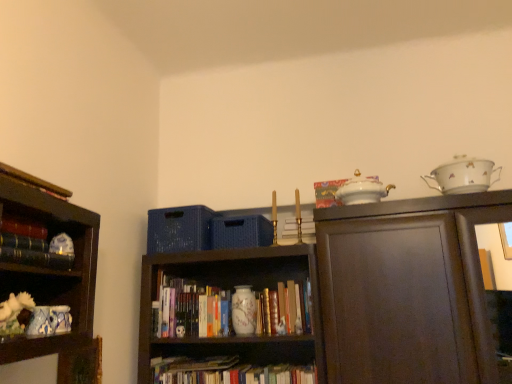
Question: Is hardcover book at center, placed as the 2th book when sorted from front to back, bigger than hardcover books at center, the 1th book ordered from the bottom?

Choices:
 (A) no
 (B) yes

Answer: (A)

Question: Can you confirm if hardcover book at center, which appears as the second book when viewed from the back, is thinner than hardcover books at center, the second book in the left-to-right sequence?

Choices:
 (A) yes
 (B) no

Answer: (A)

Question: Can you confirm if hardcover book at center, placed as the 2th book when sorted from front to back, is wider than hardcover books at center, which appears as the third book when viewed from the top?

Choices:
 (A) no
 (B) yes

Answer: (A)

Question: Does hardcover book at center, the first book from the right, have a smaller size compared to hardcover books at center, arranged as the 2th book when viewed from the right?

Choices:
 (A) yes
 (B) no

Answer: (A)

Question: From a real-world perspective, is hardcover book at center, the 2th book viewed from the top, positioned under hardcover books at center, the second book in the left-to-right sequence, based on gravity?

Choices:
 (A) yes
 (B) no

Answer: (A)

Question: Does point (289, 279) appear closer or farther from the camera than point (192, 322)?

Choices:
 (A) farther
 (B) closer

Answer: (A)

Question: In terms of height, does hardcover book at center, which ranks as the 3th book in left-to-right order, look taller or shorter compared to hardcover books at center, the second book in the left-to-right sequence?

Choices:
 (A) tall
 (B) short

Answer: (B)

Question: Considering the positions of hardcover book at center, placed as the 2th book when sorted from front to back, and hardcover books at center, the second book in the left-to-right sequence, in the image, is hardcover book at center, placed as the 2th book when sorted from front to back, bigger or smaller than hardcover books at center, the second book in the left-to-right sequence,?

Choices:
 (A) small
 (B) big

Answer: (A)

Question: In terms of width, does hardcover book at center, which is the 2th book in bottom-to-top order, look wider or thinner when compared to hardcover books at center, the second book in the left-to-right sequence?

Choices:
 (A) wide
 (B) thin

Answer: (B)

Question: From a real-world perspective, is hardcover books at center, which is the 1th book in back-to-front order, above or below white porcelain teapot at upper center?

Choices:
 (A) above
 (B) below

Answer: (B)

Question: From the image's perspective, is hardcover books at center, which appears as the third book when viewed from the top, above or below white porcelain teapot at upper center?

Choices:
 (A) below
 (B) above

Answer: (A)

Question: Is hardcover books at center, the 1th book ordered from the bottom, spatially inside white porcelain teapot at upper center, or outside of it?

Choices:
 (A) outside
 (B) inside

Answer: (A)

Question: Considering their positions, is hardcover books at center, arranged as the 2th book when viewed from the right, located in front of or behind white porcelain teapot at upper center?

Choices:
 (A) front
 (B) behind

Answer: (B)

Question: Considering the positions of white porcelain teapot at upper center and hardcover book at center, the first book from the right, in the image, is white porcelain teapot at upper center wider or thinner than hardcover book at center, the first book from the right,?

Choices:
 (A) wide
 (B) thin

Answer: (A)

Question: From the image's perspective, is white porcelain teapot at upper center positioned above or below hardcover book at center, which is the 2th book in bottom-to-top order?

Choices:
 (A) below
 (B) above

Answer: (B)